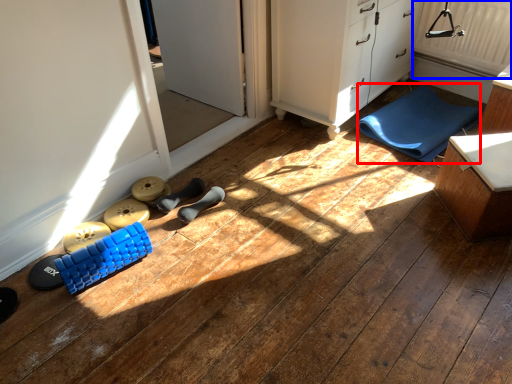
Question: Which point is closer to the camera, yoga mat (highlighted by a red box) or radiator (highlighted by a blue box)?

Choices:
 (A) yoga mat
 (B) radiator

Answer: (A)